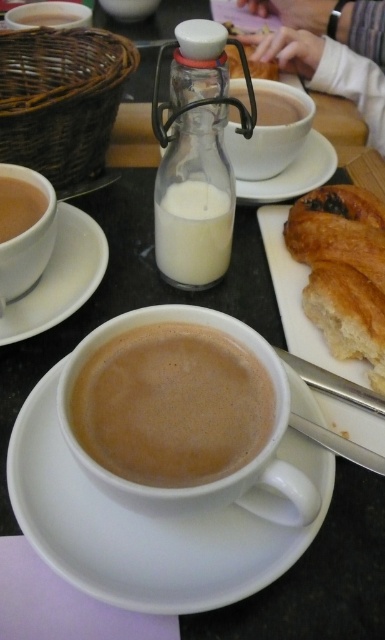
Question: Among these objects, which one is nearest to the camera?

Choices:
 (A) white ceramic saucer at upper center
 (B) white ceramic saucer at lower center
 (C) white matte cup of coffee at upper center

Answer: (B)

Question: Which point is closer to the camera taking this photo?

Choices:
 (A) (88, 392)
 (B) (217, 580)

Answer: (B)

Question: Can you confirm if brown matte cup at center is smaller than white ceramic saucer at upper center?

Choices:
 (A) yes
 (B) no

Answer: (A)

Question: Is golden brown flaky croissant at right to the right of white matte cup of coffee at upper center from the viewer's perspective?

Choices:
 (A) no
 (B) yes

Answer: (B)

Question: Is white ceramic saucer at upper left to the left of white matte milk at center from the viewer's perspective?

Choices:
 (A) yes
 (B) no

Answer: (A)

Question: Which object is the closest to the white matte milk at center?

Choices:
 (A) white ceramic saucer at upper center
 (B) white matte cup of coffee at upper center
 (C) golden brown flaky croissant at right
 (D) white ceramic saucer at lower center

Answer: (C)